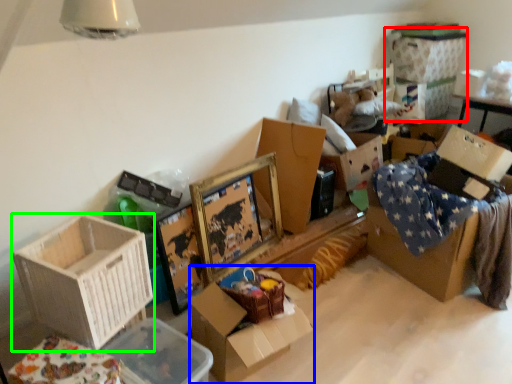
Question: Considering the real-world distances, which object is closest to storage box (highlighted by a red box)? box (highlighted by a blue box) or box (highlighted by a green box).

Choices:
 (A) box
 (B) box

Answer: (A)